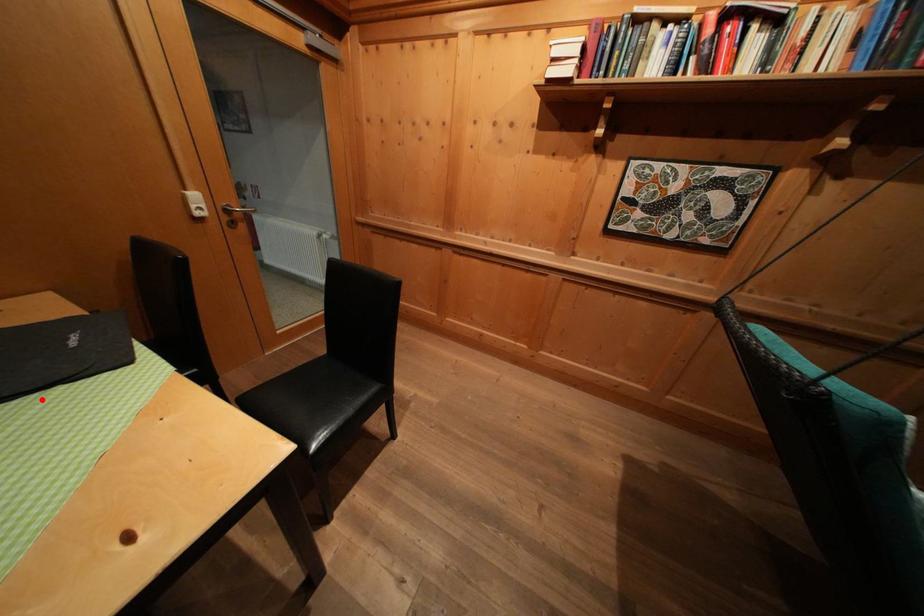
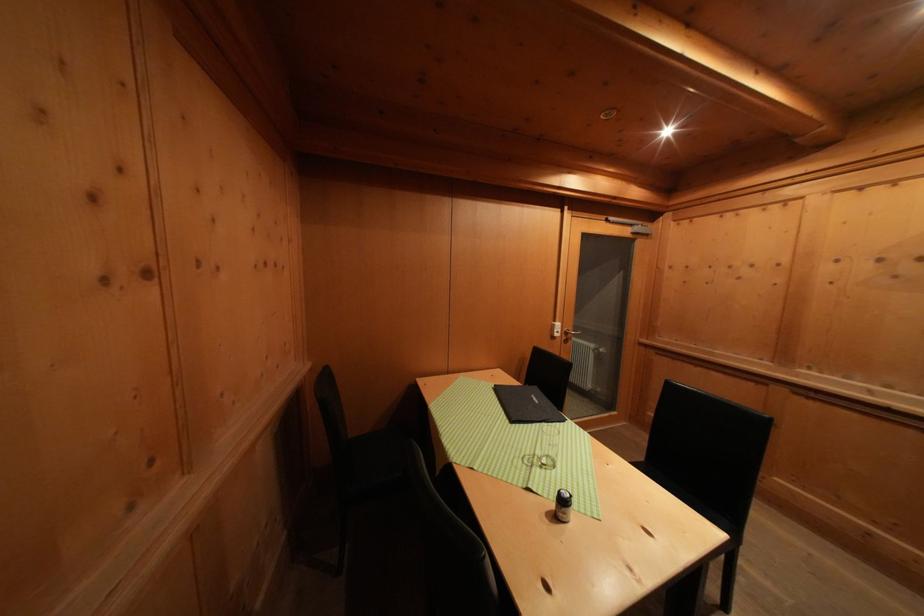
Where in the second image is the point corresponding to the highlighted location from the first image?

(543, 429)